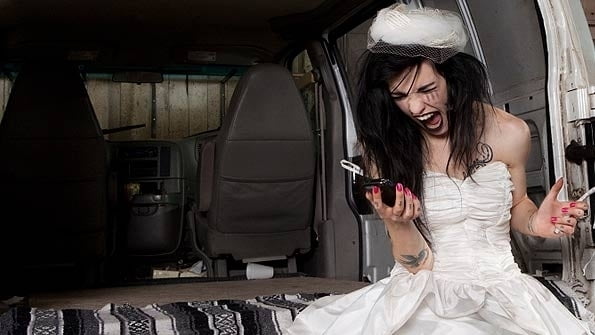
The width and height of the screenshot is (595, 335). Find the location of `black seats`. black seats is located at coordinates (294, 134), (71, 123).